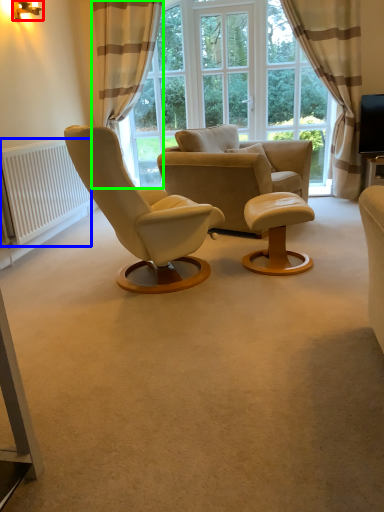
Question: Which is nearer to the lamp (highlighted by a red box)? radiator (highlighted by a blue box) or curtain (highlighted by a green box).

Choices:
 (A) radiator
 (B) curtain

Answer: (B)